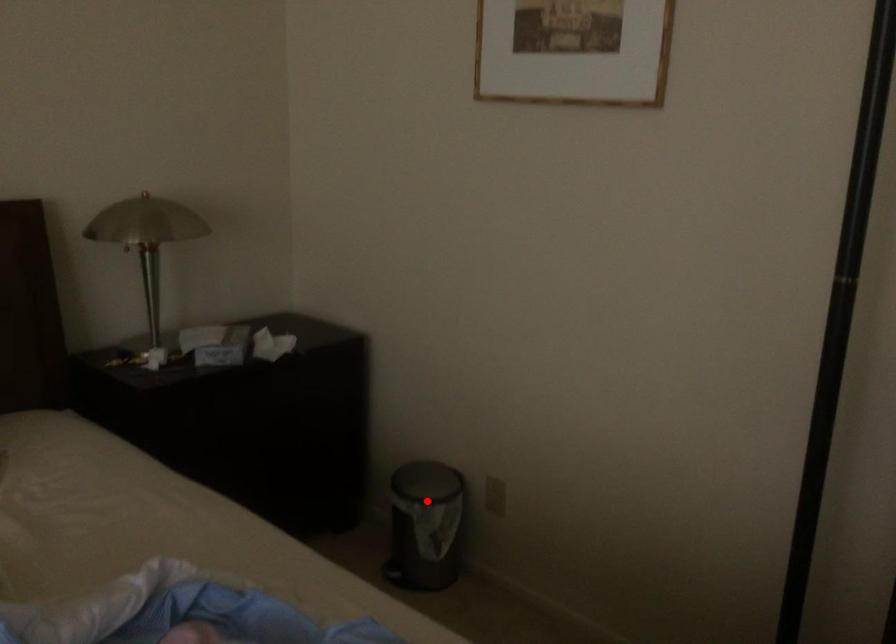
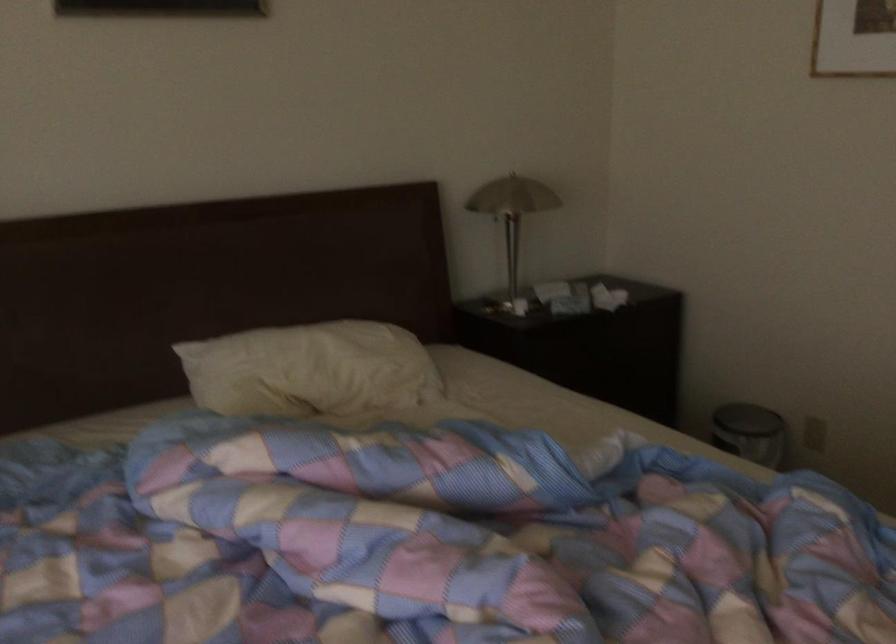
Question: I am providing you with two images of the same scene from different viewpoints. A red point is shown in image1. For the corresponding object point in image2, is it positioned nearer or farther from the camera?

Choices:
 (A) Nearer
 (B) Farther

Answer: (B)